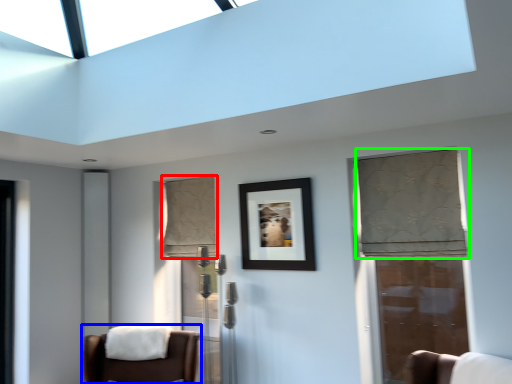
Question: Based on their relative distances, which object is nearer to curtain (highlighted by a red box)? Choose from chair (highlighted by a blue box) and curtain (highlighted by a green box).

Choices:
 (A) chair
 (B) curtain

Answer: (A)